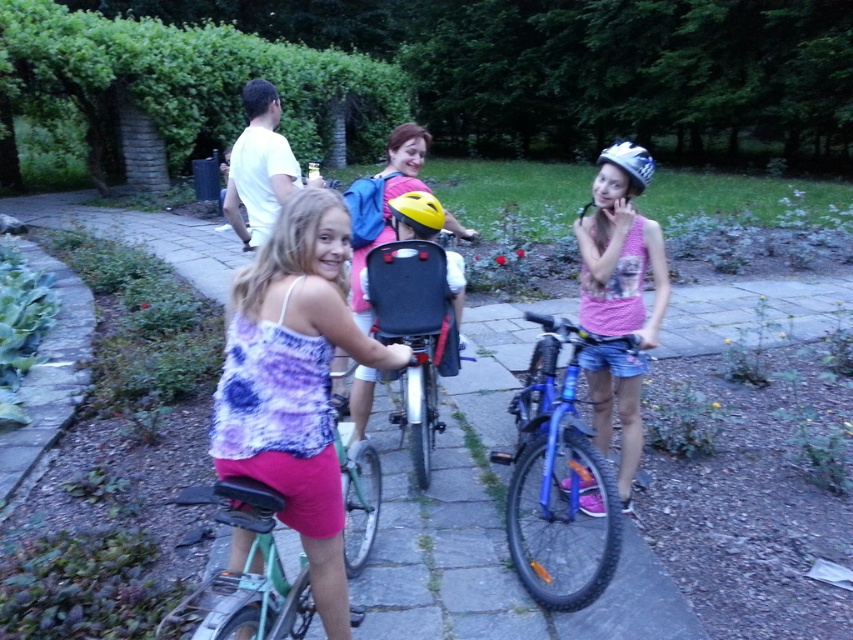
Question: Which point is closer to the camera taking this photo?

Choices:
 (A) (514, 470)
 (B) (595, 228)
 (C) (618, 154)

Answer: (A)

Question: Which object appears farthest from the camera in this image?

Choices:
 (A) pink fabric shirt at center
 (B) white matte bicycle helmet at upper right
 (C) matte purple tank top at center

Answer: (B)

Question: Can you confirm if green stone pavement at center is positioned to the left of pink fabric shirt at center?

Choices:
 (A) no
 (B) yes

Answer: (B)

Question: Which of the following is the farthest from the observer?

Choices:
 (A) (634, 170)
 (B) (490, 525)

Answer: (B)

Question: Is blue metallic bicycle at center below white matte bicycle helmet at upper right?

Choices:
 (A) no
 (B) yes

Answer: (B)

Question: Does pink fabric shirt at center appear over black fabric bicycle seat at center?

Choices:
 (A) yes
 (B) no

Answer: (A)